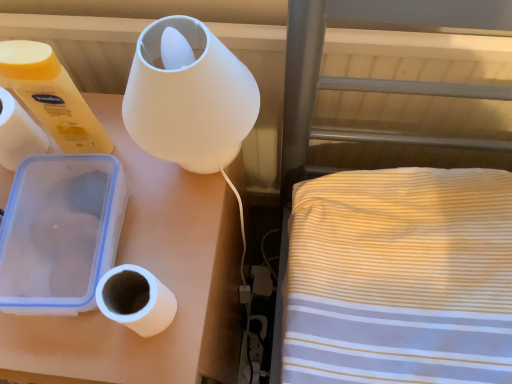
Question: Are white matte paper towel at left and white matte toilet paper at left, positioned as the 2th toilet paper in right-to-left order, beside each other?

Choices:
 (A) yes
 (B) no

Answer: (A)

Question: Is the depth of white matte paper towel at left less than that of white matte toilet paper at left, the first toilet paper from the left?

Choices:
 (A) no
 (B) yes

Answer: (A)

Question: Is white matte paper towel at left to the left of white matte toilet paper at left, positioned as the 2th toilet paper in right-to-left order, from the viewer's perspective?

Choices:
 (A) no
 (B) yes

Answer: (B)

Question: Can you confirm if white matte paper towel at left is positioned to the right of white matte toilet paper at left, positioned as the first toilet paper in top-to-bottom order?

Choices:
 (A) no
 (B) yes

Answer: (A)

Question: Does white matte paper towel at left have a larger size compared to white matte toilet paper at left, which is the second toilet paper from bottom to top?

Choices:
 (A) yes
 (B) no

Answer: (B)

Question: Can you confirm if white matte paper towel at left is taller than white matte toilet paper at left, the first toilet paper from the left?

Choices:
 (A) yes
 (B) no

Answer: (B)

Question: Is white matte paper towel at left with frosted glass lamp at upper center?

Choices:
 (A) yes
 (B) no

Answer: (B)

Question: Is the depth of white matte paper towel at left less than that of frosted glass lamp at upper center?

Choices:
 (A) yes
 (B) no

Answer: (B)

Question: Considering the relative sizes of white matte paper towel at left and frosted glass lamp at upper center in the image provided, is white matte paper towel at left wider than frosted glass lamp at upper center?

Choices:
 (A) no
 (B) yes

Answer: (A)

Question: Is white matte paper towel at left at the left side of frosted glass lamp at upper center?

Choices:
 (A) yes
 (B) no

Answer: (A)

Question: Can you confirm if white matte paper towel at left is thinner than frosted glass lamp at upper center?

Choices:
 (A) no
 (B) yes

Answer: (B)

Question: From the image's perspective, is white matte paper towel at left located above frosted glass lamp at upper center?

Choices:
 (A) yes
 (B) no

Answer: (B)

Question: From the image's perspective, is white matte toilet paper at left, positioned as the first toilet paper in top-to-bottom order, located beneath white matte paper towel at left?

Choices:
 (A) yes
 (B) no

Answer: (B)